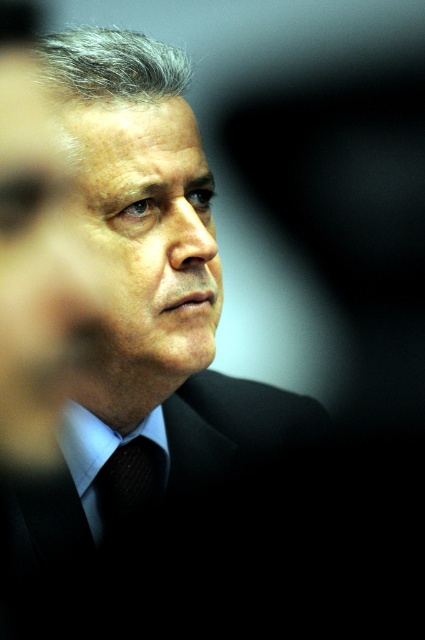
Question: Among these points, which one is nearest to the camera?

Choices:
 (A) (96, 452)
 (B) (147, 461)
 (C) (105, 488)

Answer: (A)

Question: Which of the following is the farthest from the observer?

Choices:
 (A) black silk suit at center
 (B) black textured tie at center

Answer: (B)

Question: Can you confirm if black silk suit at center is thinner than light blue fabric dress shirt at center?

Choices:
 (A) no
 (B) yes

Answer: (A)

Question: Does black silk suit at center have a smaller size compared to light blue fabric dress shirt at center?

Choices:
 (A) no
 (B) yes

Answer: (A)

Question: Does black textured tie at center lie in front of light blue fabric dress shirt at center?

Choices:
 (A) no
 (B) yes

Answer: (B)

Question: Which object appears farthest from the camera in this image?

Choices:
 (A) black silk suit at center
 (B) light blue fabric dress shirt at center

Answer: (B)